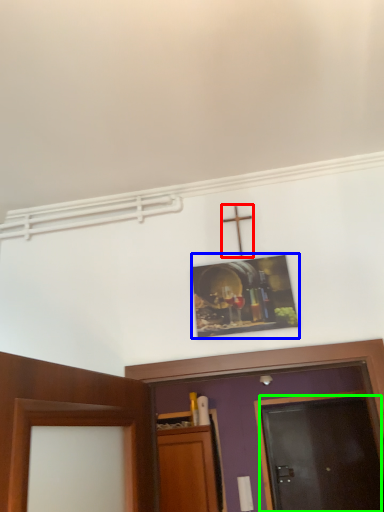
Question: Which is farther away from crucifix (highlighted by a red box)? picture frame (highlighted by a blue box) or door (highlighted by a green box)?

Choices:
 (A) picture frame
 (B) door

Answer: (B)